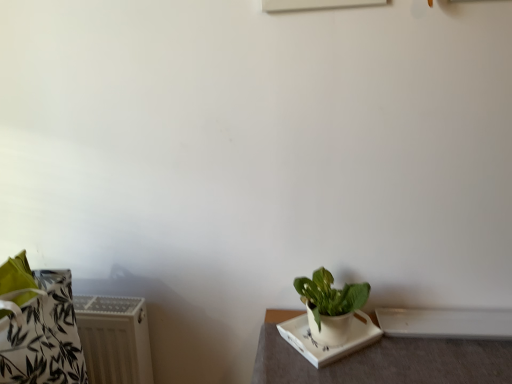
Question: From the image's perspective, is white ceramic tray at lower right under white textured radiator at lower left?

Choices:
 (A) no
 (B) yes

Answer: (B)

Question: Is white ceramic tray at lower right positioned beyond the bounds of white textured radiator at lower left?

Choices:
 (A) no
 (B) yes

Answer: (B)

Question: Does white ceramic tray at lower right have a lesser height compared to white textured radiator at lower left?

Choices:
 (A) no
 (B) yes

Answer: (B)

Question: Can you confirm if white ceramic tray at lower right is bigger than white textured radiator at lower left?

Choices:
 (A) no
 (B) yes

Answer: (B)

Question: Can you confirm if white ceramic tray at lower right is smaller than white textured radiator at lower left?

Choices:
 (A) yes
 (B) no

Answer: (B)

Question: Could you tell me if white ceramic tray at lower right is facing white textured radiator at lower left?

Choices:
 (A) no
 (B) yes

Answer: (A)

Question: Does white ceramic tray at lower right have a greater width compared to white ceramic plate at lower right?

Choices:
 (A) yes
 (B) no

Answer: (A)

Question: Considering the relative positions of white ceramic tray at lower right and white ceramic plate at lower right in the image provided, is white ceramic tray at lower right to the right of white ceramic plate at lower right from the viewer's perspective?

Choices:
 (A) no
 (B) yes

Answer: (B)

Question: From a real-world perspective, does white ceramic tray at lower right stand above white ceramic plate at lower right?

Choices:
 (A) yes
 (B) no

Answer: (B)

Question: Is white ceramic tray at lower right to the left of white ceramic plate at lower right from the viewer's perspective?

Choices:
 (A) yes
 (B) no

Answer: (B)

Question: From the image's perspective, does white ceramic tray at lower right appear lower than white ceramic plate at lower right?

Choices:
 (A) yes
 (B) no

Answer: (A)

Question: Is the depth of white ceramic tray at lower right greater than that of white ceramic plate at lower right?

Choices:
 (A) no
 (B) yes

Answer: (A)

Question: Does white ceramic tray at lower right have a lesser width compared to green matte plant at lower right?

Choices:
 (A) yes
 (B) no

Answer: (B)